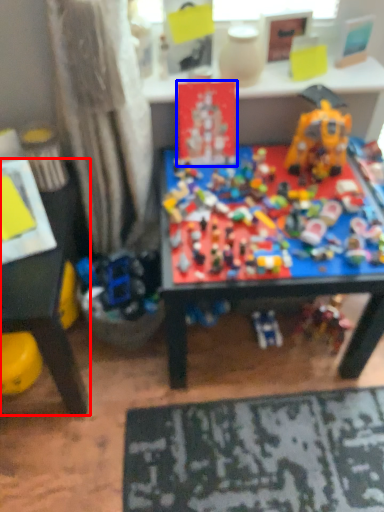
Question: Which point is further to the camera, table (highlighted by a red box) or toy (highlighted by a blue box)?

Choices:
 (A) table
 (B) toy

Answer: (B)